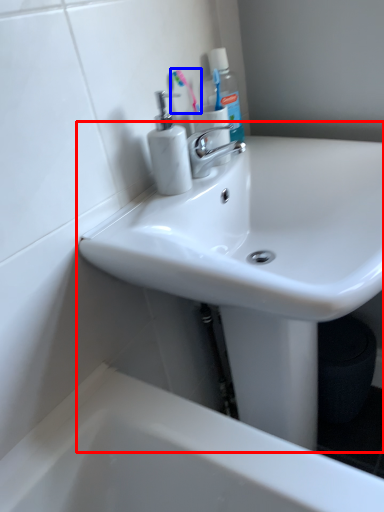
Question: Which object appears farthest to the camera in this image, sink (highlighted by a red box) or toothbrush (highlighted by a blue box)?

Choices:
 (A) sink
 (B) toothbrush

Answer: (B)